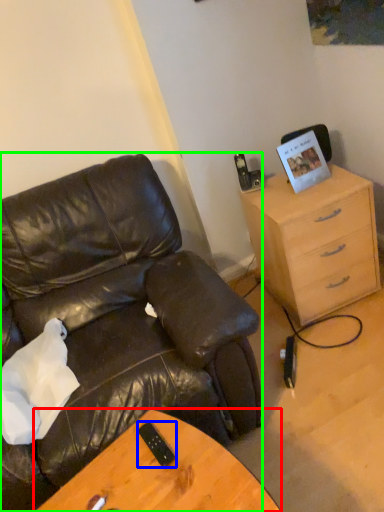
Question: Which is nearer to the desk (highlighted by a red box)? mobile phone (highlighted by a blue box) or chair (highlighted by a green box).

Choices:
 (A) mobile phone
 (B) chair

Answer: (A)